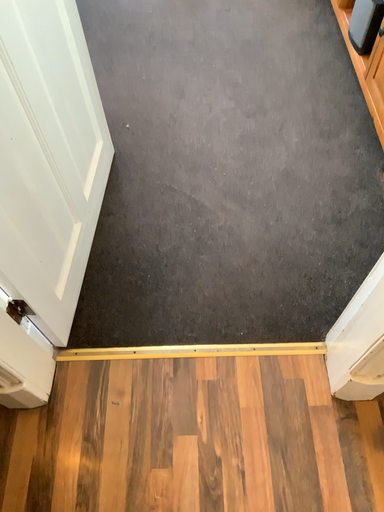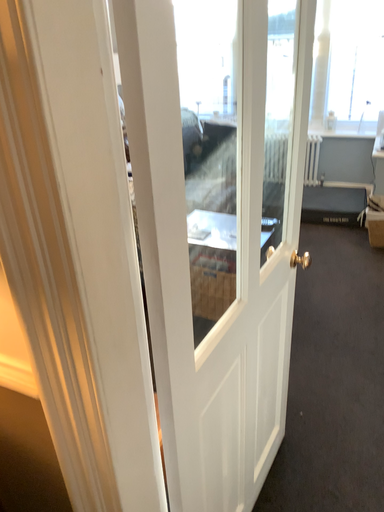
Question: Which way did the camera rotate in the video?

Choices:
 (A) rotated downward
 (B) rotated upward

Answer: (B)